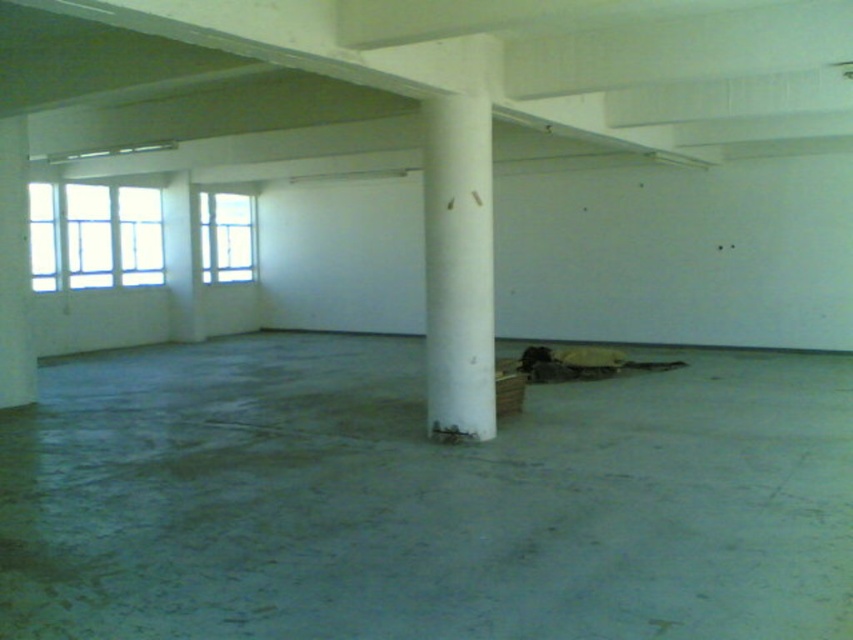
Does white smooth column at center appear under clear glass window at upper left?

Yes, white smooth column at center is below clear glass window at upper left.

Does white smooth column at center have a lesser height compared to clear glass window at upper left?

No.

This screenshot has height=640, width=853. Find the location of `white smooth column at center`. white smooth column at center is located at coordinates (457, 266).

Where is `white smooth column at center`? Image resolution: width=853 pixels, height=640 pixels. white smooth column at center is located at coordinates (457, 266).

Between clear glass windows at upper left and clear glass window at upper left, which one is positioned lower?

Positioned lower is clear glass windows at upper left.

Who is more forward, (65, 216) or (245, 205)?

Point (65, 216)

Identify the location of clear glass windows at upper left. (94, 236).

Which of these two, white smooth column at center or clear glass windows at upper left, stands taller?

With more height is white smooth column at center.

Is point (426, 268) less distant than point (79, 214)?

That is True.

What are the coordinates of `white smooth column at center` in the screenshot? It's located at (457, 266).